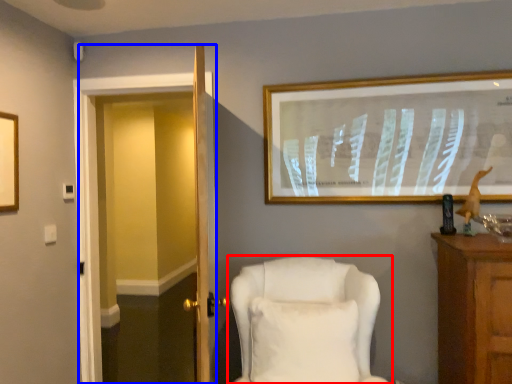
Question: Which point is closer to the camera, chair (highlighted by a red box) or glass door (highlighted by a blue box)?

Choices:
 (A) chair
 (B) glass door

Answer: (A)